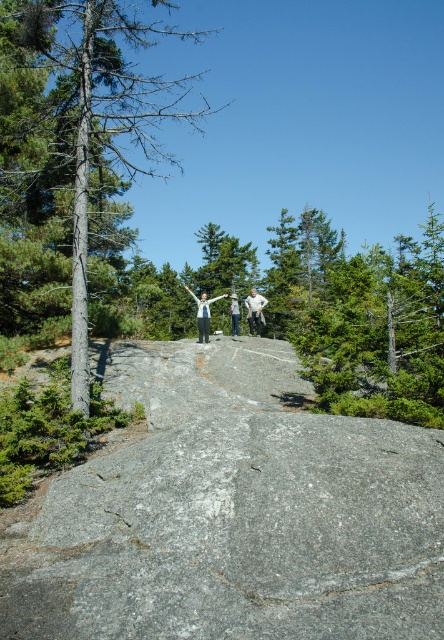
Question: Can you confirm if green textured tree at center is positioned above white cotton shirt at center?

Choices:
 (A) yes
 (B) no

Answer: (A)

Question: Which of the following is the closest to the observer?

Choices:
 (A) green textured tree at center
 (B) white fabric pants at center

Answer: (A)

Question: Is gray rough rock at center smaller than green textured tree at center?

Choices:
 (A) yes
 (B) no

Answer: (A)

Question: Estimate the real-world distances between objects in this image. Which object is closer to the gray rough rock at center?

Choices:
 (A) white cotton shirt at center
 (B) white fabric pants at center

Answer: (B)

Question: Is white cotton shirt at center above white fabric pants at center?

Choices:
 (A) no
 (B) yes

Answer: (A)

Question: Among these objects, which one is farthest from the camera?

Choices:
 (A) gray rough rock at center
 (B) white fabric at center
 (C) green textured tree at center

Answer: (B)